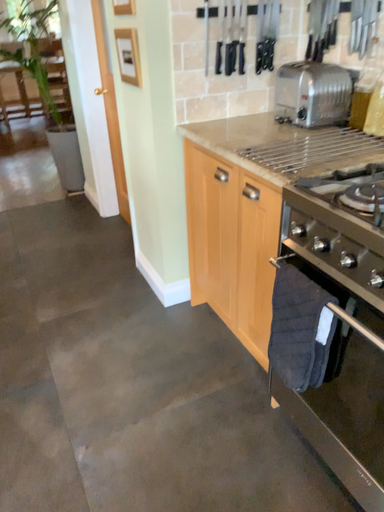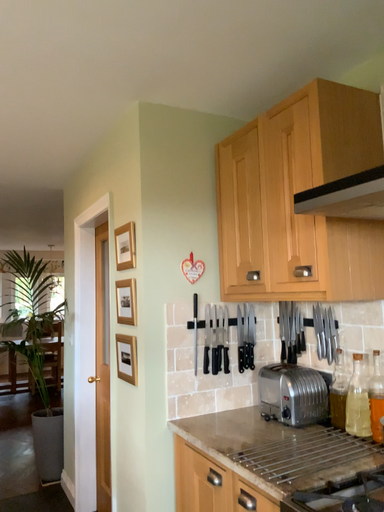
Question: Which way did the camera rotate in the video?

Choices:
 (A) rotated upward
 (B) rotated downward

Answer: (A)